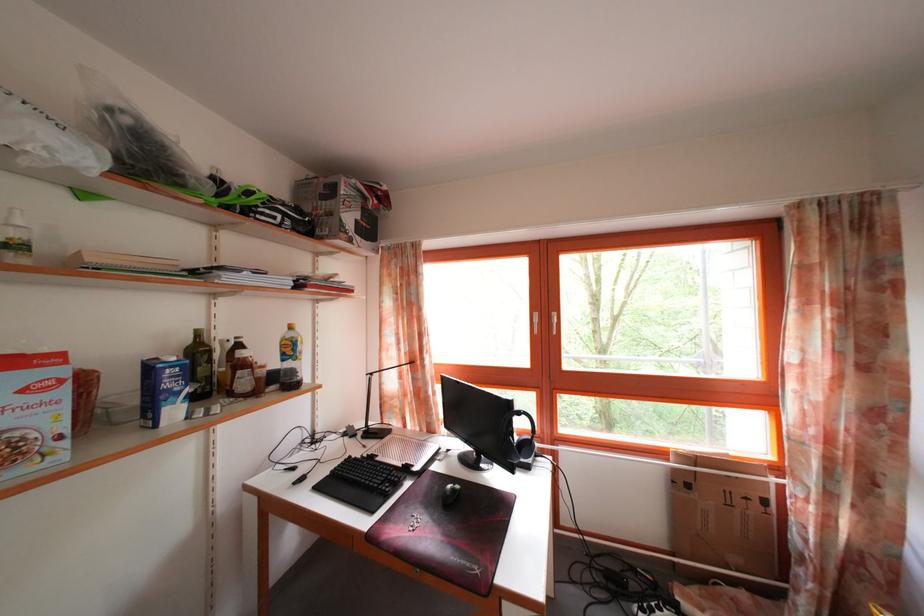
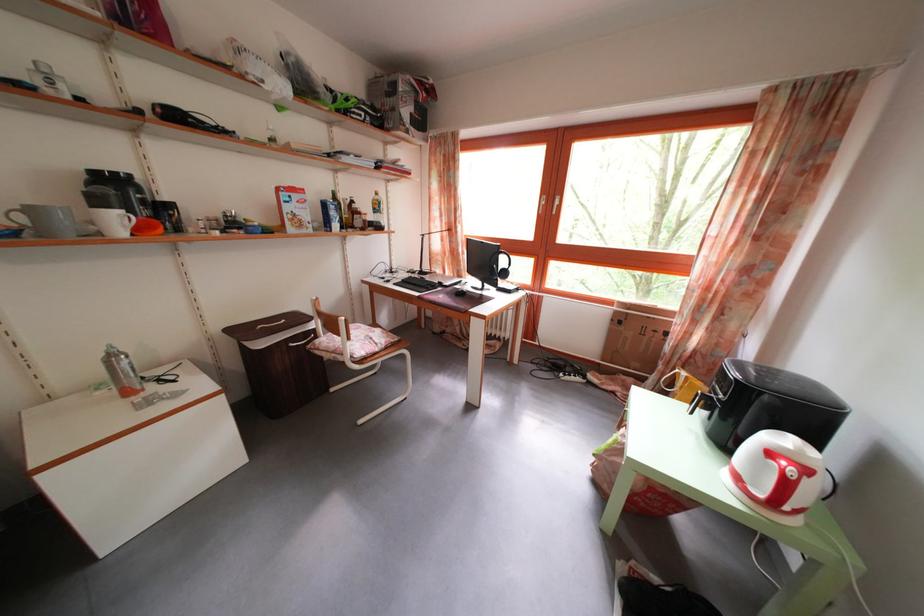
Locate, in the second image, the point that corresponds to point 426,482 in the first image.

(454, 294)